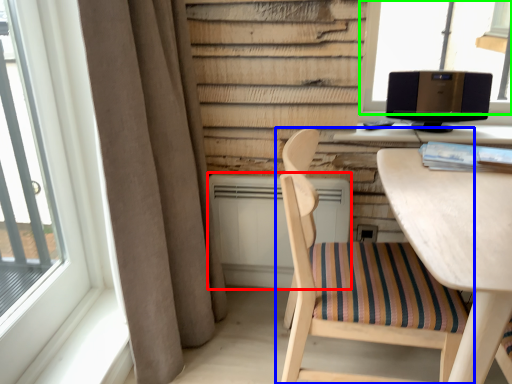
Question: Based on their relative distances, which object is nearer to air conditioner (highlighted by a red box)? Choose from chair (highlighted by a blue box) and window (highlighted by a green box).

Choices:
 (A) chair
 (B) window

Answer: (A)